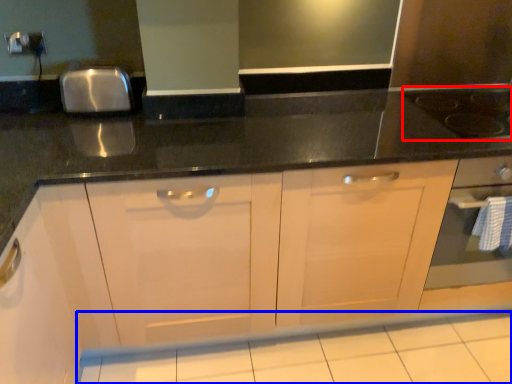
Question: Which point is closer to the camera, gas stove (highlighted by a red box) or tile (highlighted by a blue box)?

Choices:
 (A) gas stove
 (B) tile

Answer: (B)